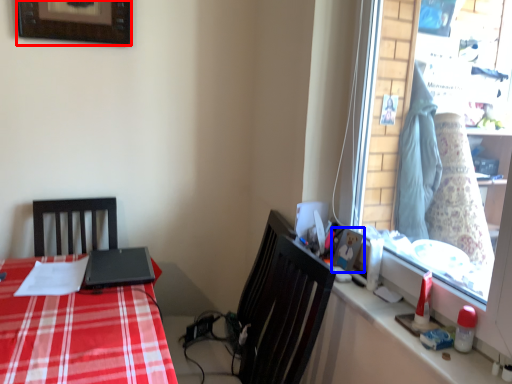
Question: Which point is further to the camera, picture frame (highlighted by a red box) or picture frame (highlighted by a blue box)?

Choices:
 (A) picture frame
 (B) picture frame

Answer: (A)